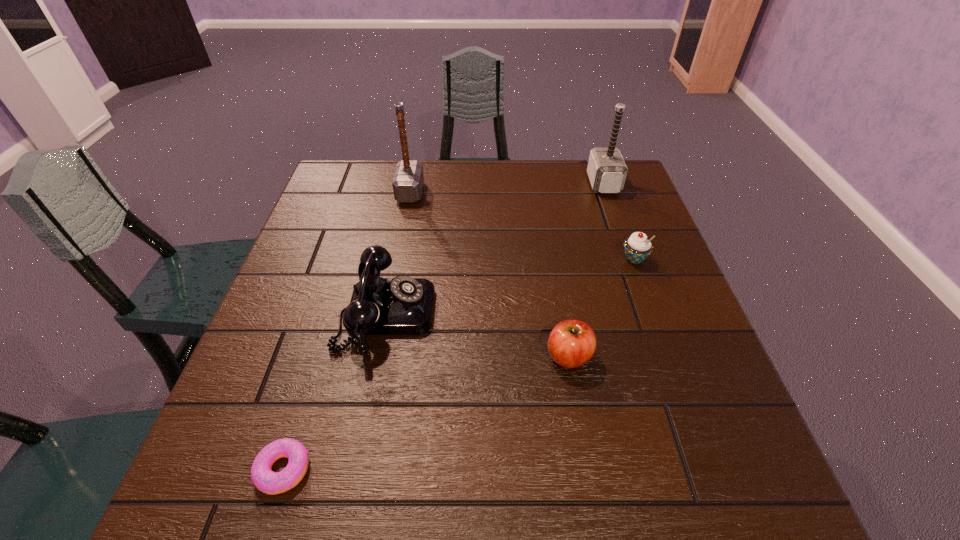
The height and width of the screenshot is (540, 960). Identify the location of vacant region that satisfies the following two spatial constraints: 1. on the back side of the third object from right to left; 2. on the striking surface of the left hammer. (540, 192).

Locate an element on the screen. This screenshot has height=540, width=960. vacant space that satisfies the following two spatial constraints: 1. on the back side of the cupcake; 2. for striking with the head of the right hammer is located at coordinates coord(607,184).

Where is `free location that satisfies the following two spatial constraints: 1. for striking with the head of the right hammer; 2. on the back side of the fourth nearest object`? free location that satisfies the following two spatial constraints: 1. for striking with the head of the right hammer; 2. on the back side of the fourth nearest object is located at coordinates (630, 259).